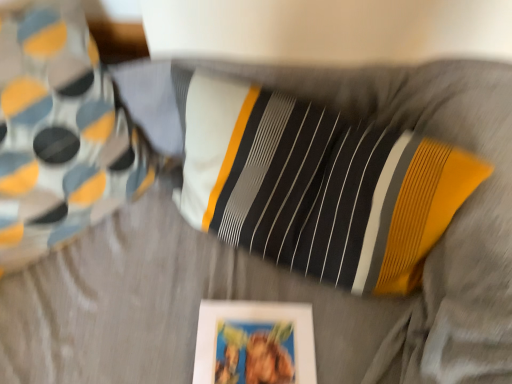
Identify the location of matte white picture frame at lower center. Image resolution: width=512 pixels, height=384 pixels. (254, 343).

Describe the element at coordinates (254, 343) in the screenshot. The width and height of the screenshot is (512, 384). I see `matte white picture frame at lower center` at that location.

The width and height of the screenshot is (512, 384). Find the location of `striped fabric pillow at upper left`. striped fabric pillow at upper left is located at coordinates (59, 133).

What do you see at coordinates (59, 133) in the screenshot? The width and height of the screenshot is (512, 384). I see `striped fabric pillow at upper left` at bounding box center [59, 133].

Image resolution: width=512 pixels, height=384 pixels. Find the location of `matte white picture frame at lower center`. matte white picture frame at lower center is located at coordinates (254, 343).

Is striped fabric pillow at upper left at the left side of matte white picture frame at lower center?

Yes.

Between striped fabric pillow at upper left and matte white picture frame at lower center, which one is positioned in front?

striped fabric pillow at upper left is closer to the camera.

Which is closer to the camera, (12, 34) or (269, 337)?

Point (12, 34) is positioned closer to the camera compared to point (269, 337).

From the image's perspective, does striped fabric pillow at upper left appear lower than matte white picture frame at lower center?

No, from the image's perspective, striped fabric pillow at upper left is not below matte white picture frame at lower center.

From a real-world perspective, does striped fabric pillow at upper left stand above matte white picture frame at lower center?

Yes, from a real-world perspective, striped fabric pillow at upper left is over matte white picture frame at lower center

Considering the relative sizes of striped fabric pillow at upper left and matte white picture frame at lower center in the image provided, is striped fabric pillow at upper left thinner than matte white picture frame at lower center?

Yes, striped fabric pillow at upper left is thinner than matte white picture frame at lower center.

Consider the image. Can you confirm if striped fabric pillow at upper left is shorter than matte white picture frame at lower center?

No, striped fabric pillow at upper left is not shorter than matte white picture frame at lower center.

Considering the relative sizes of striped fabric pillow at upper left and matte white picture frame at lower center in the image provided, is striped fabric pillow at upper left bigger than matte white picture frame at lower center?

Yes, striped fabric pillow at upper left is bigger than matte white picture frame at lower center.

Is striped fabric pillow at upper left positioned beyond the bounds of matte white picture frame at lower center?

striped fabric pillow at upper left is positioned outside matte white picture frame at lower center.

Would you consider striped fabric pillow at upper left to be distant from matte white picture frame at lower center?

No, striped fabric pillow at upper left is not far away from matte white picture frame at lower center.

Looking at this image, could you tell me if striped fabric pillow at upper left is facing matte white picture frame at lower center?

Yes, striped fabric pillow at upper left is oriented towards matte white picture frame at lower center.

Can you tell me how much striped fabric pillow at upper left and matte white picture frame at lower center differ in facing direction?

There is a 43.3-degree angle between the facing directions of striped fabric pillow at upper left and matte white picture frame at lower center.

Could you measure the distance between striped fabric pillow at upper left and matte white picture frame at lower center?

striped fabric pillow at upper left and matte white picture frame at lower center are 42.59 centimeters apart.

Identify the location of pillow on the left of matte white picture frame at lower center. (59, 133).

Considering the relative positions of matte white picture frame at lower center and striped fabric pillow at upper left in the image provided, is matte white picture frame at lower center to the right of striped fabric pillow at upper left from the viewer's perspective?

Yes.

Is matte white picture frame at lower center further to the viewer compared to striped fabric pillow at upper left?

Yes, matte white picture frame at lower center is further from the camera.

Is point (237, 317) farther from viewer compared to point (33, 123)?

Yes, point (237, 317) is behind point (33, 123).

From the image's perspective, is matte white picture frame at lower center positioned above or below striped fabric pillow at upper left?

Based on their image positions, matte white picture frame at lower center is located beneath striped fabric pillow at upper left.

From a real-world perspective, is matte white picture frame at lower center physically located above or below striped fabric pillow at upper left?

Clearly, from a real-world perspective, matte white picture frame at lower center is below striped fabric pillow at upper left.

Based on the photo, considering the relative sizes of matte white picture frame at lower center and striped fabric pillow at upper left in the image provided, is matte white picture frame at lower center wider than striped fabric pillow at upper left?

Indeed, matte white picture frame at lower center has a greater width compared to striped fabric pillow at upper left.

Does matte white picture frame at lower center have a lesser height compared to striped fabric pillow at upper left?

Yes, matte white picture frame at lower center is shorter than striped fabric pillow at upper left.

Does matte white picture frame at lower center have a smaller size compared to striped fabric pillow at upper left?

Indeed, matte white picture frame at lower center has a smaller size compared to striped fabric pillow at upper left.

Do you think matte white picture frame at lower center is within striped fabric pillow at upper left, or outside of it?

matte white picture frame at lower center is spatially situated outside striped fabric pillow at upper left.

Are matte white picture frame at lower center and striped fabric pillow at upper left making contact?

No, matte white picture frame at lower center is not in contact with striped fabric pillow at upper left.

Is matte white picture frame at lower center facing towards striped fabric pillow at upper left?

No, matte white picture frame at lower center is not oriented towards striped fabric pillow at upper left.

Looking at this image, how different are the orientations of matte white picture frame at lower center and striped fabric pillow at upper left in degrees?

Result: The angular difference between matte white picture frame at lower center and striped fabric pillow at upper left is 43.3 degrees.

Measure the distance from matte white picture frame at lower center to striped fabric pillow at upper left.

matte white picture frame at lower center and striped fabric pillow at upper left are 42.59 centimeters apart.

You are a GUI agent. You are given a task and a screenshot of the screen. Output one action in this format:
    pyautogui.click(x=<x>, y=<y>)
    Task: Click on the pillow located on the left of matte white picture frame at lower center
    The width and height of the screenshot is (512, 384).
    Given the screenshot: What is the action you would take?
    pyautogui.click(x=59, y=133)

Where is `pillow above the matte white picture frame at lower center (from the image's perspective)`? The height and width of the screenshot is (384, 512). pillow above the matte white picture frame at lower center (from the image's perspective) is located at coordinates (59, 133).

Where is `picture frame below the striped fabric pillow at upper left (from the image's perspective)`? picture frame below the striped fabric pillow at upper left (from the image's perspective) is located at coordinates (254, 343).